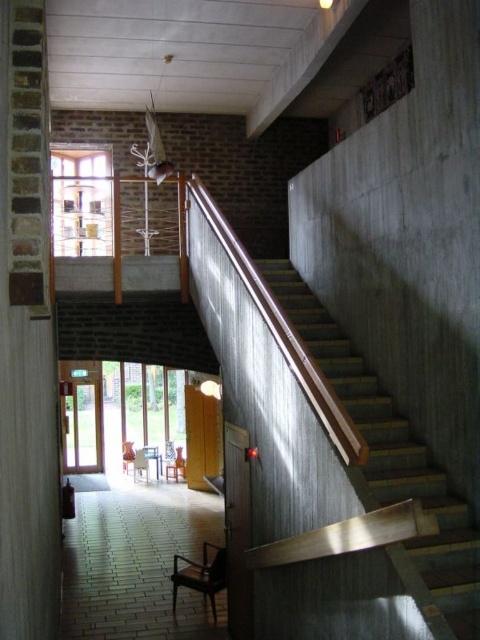
Question: Can you confirm if brick at left is thinner than wooden stairs at right?

Choices:
 (A) yes
 (B) no

Answer: (A)

Question: Which point is farther to the camera?

Choices:
 (A) wooden stairs at right
 (B) brick at left

Answer: (A)

Question: Where is brick at left located in relation to wooden stairs at right in the image?

Choices:
 (A) right
 (B) left

Answer: (B)

Question: Is brick at left smaller than wooden stairs at right?

Choices:
 (A) no
 (B) yes

Answer: (B)